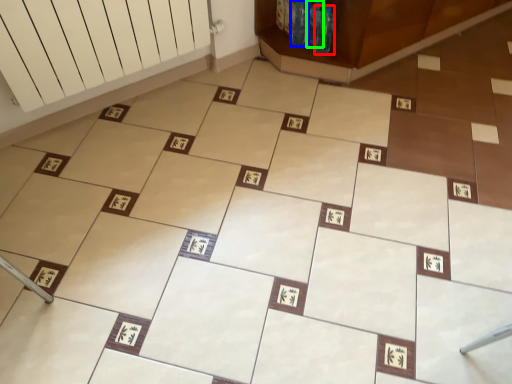
Question: Estimate the real-world distances between objects in this image. Which object is farther from bottle (highlighted by a red box), bottle (highlighted by a blue box) or bottle (highlighted by a green box)?

Choices:
 (A) bottle
 (B) bottle

Answer: (A)